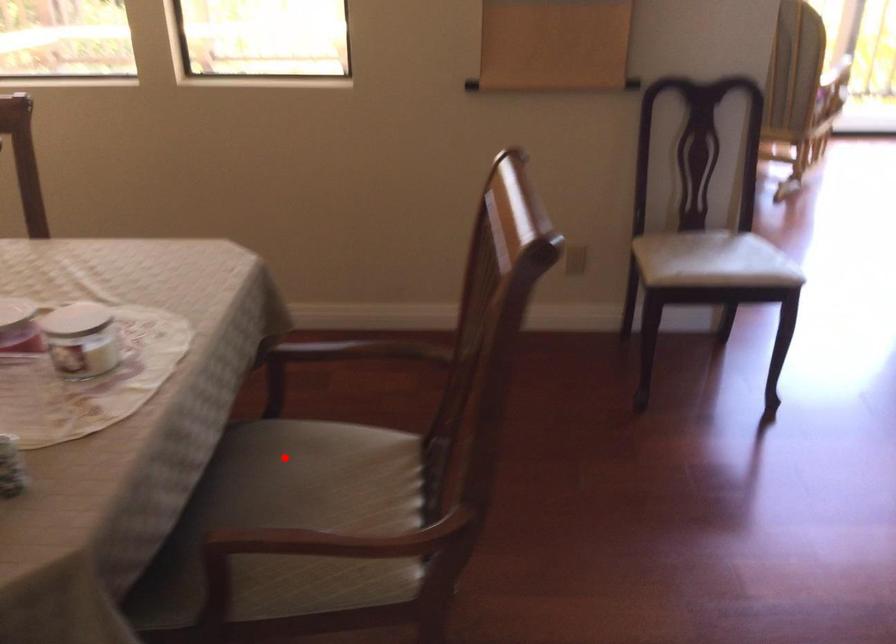
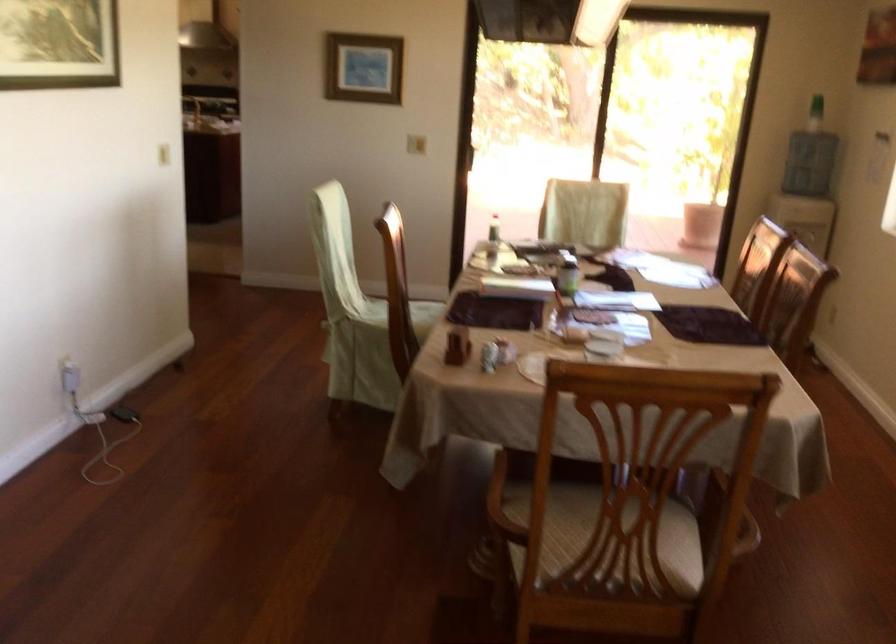
Question: A red point is marked in image1. In image2, is the corresponding 3D point closer to the camera or farther? Reply with the corresponding letter.

Choices:
 (A) The corresponding 3D point is closer.
 (B) The corresponding 3D point is farther.

Answer: (B)